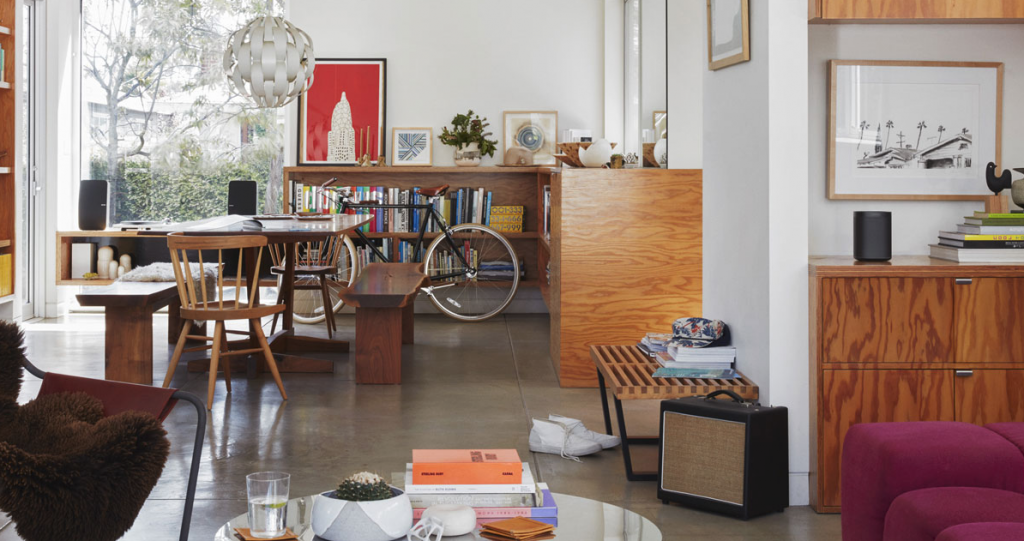
Locate an element on the screen. shelf is located at coordinates (615, 262).